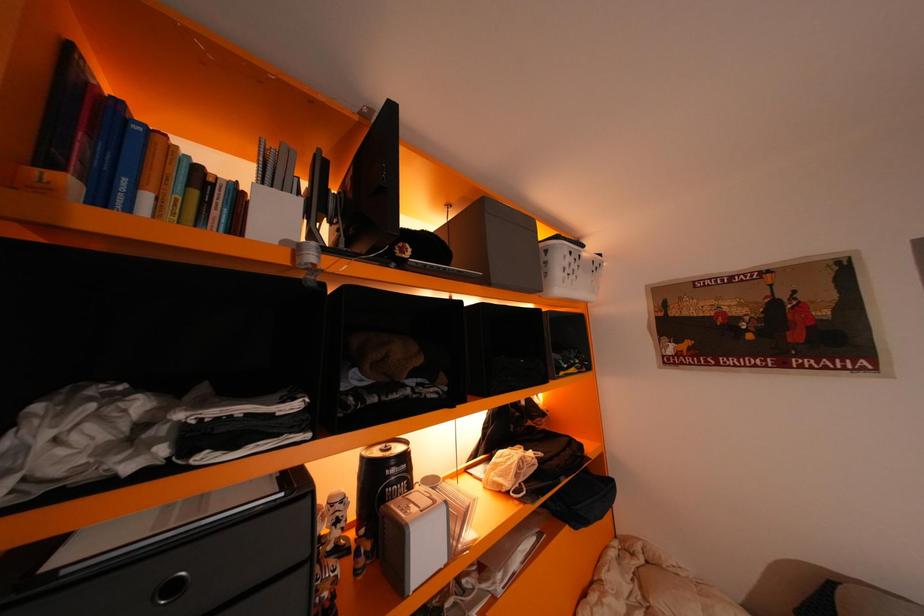
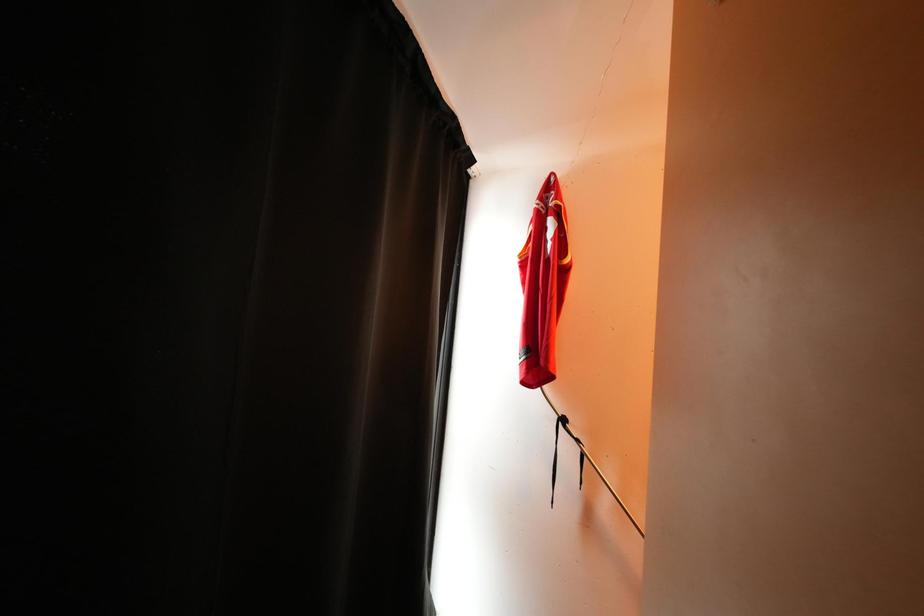
Question: The first image is from the beginning of the video and the second image is from the end. How did the camera likely rotate when shooting the video?

Choices:
 (A) Left
 (B) Right
 (C) Up
 (D) Down

Answer: (A)